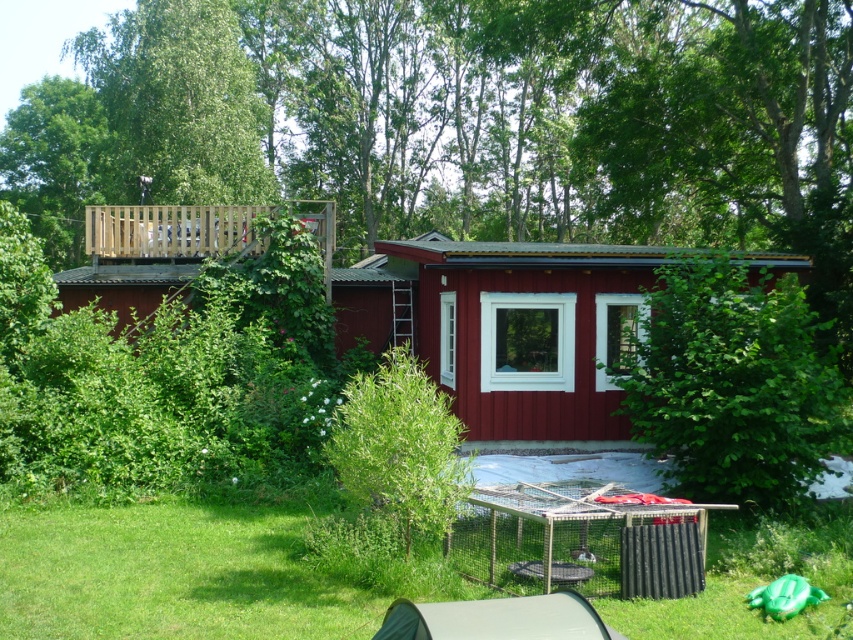
Question: Among these points, which one is nearest to the camera?

Choices:
 (A) (334, 276)
 (B) (569, 600)
 (C) (827, 524)

Answer: (B)

Question: Which is farther from the gray fabric tent at lower center?

Choices:
 (A) smooth wooden cabin at center
 (B) green grass at lower center

Answer: (A)

Question: Is green grass at lower center bigger than gray fabric tent at lower center?

Choices:
 (A) yes
 (B) no

Answer: (B)

Question: Can you confirm if green grass at lower center is bigger than smooth wooden cabin at center?

Choices:
 (A) no
 (B) yes

Answer: (A)

Question: Among these objects, which one is nearest to the camera?

Choices:
 (A) green grass at lower center
 (B) smooth wooden cabin at center

Answer: (A)

Question: Does green grass at lower center appear on the right side of smooth wooden cabin at center?

Choices:
 (A) no
 (B) yes

Answer: (A)